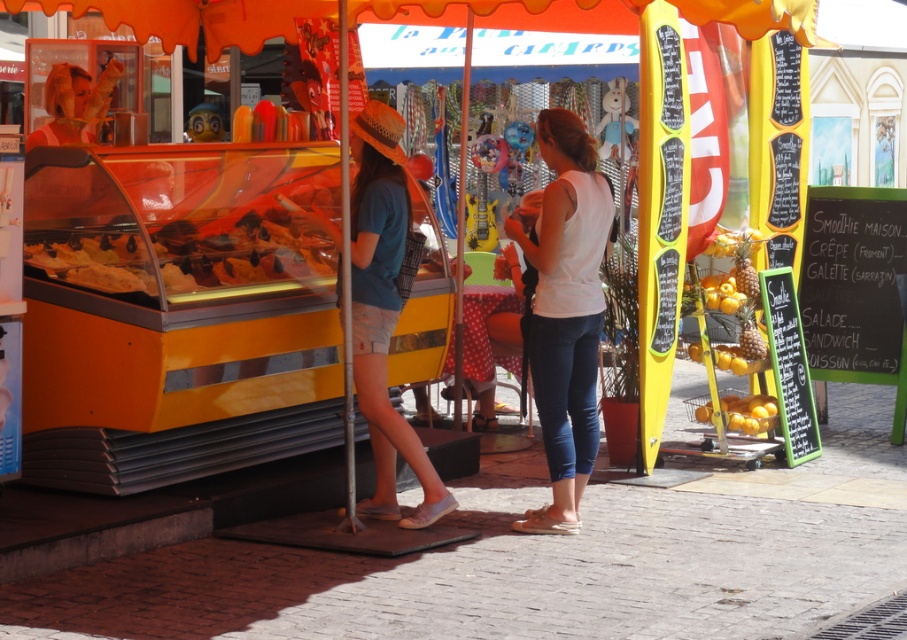
Can you confirm if denim shorts at center is positioned above yellow matte oranges at right?

Indeed, denim shorts at center is positioned over yellow matte oranges at right.

Does denim shorts at center have a lesser width compared to yellow matte oranges at right?

No, denim shorts at center is not thinner than yellow matte oranges at right.

Measure the distance between denim shorts at center and camera.

A distance of 7.93 meters exists between denim shorts at center and camera.

Locate an element on the screen. denim shorts at center is located at coordinates (383, 310).

Is white matte tank top at center shorter than denim shorts at center?

Indeed, white matte tank top at center has a lesser height compared to denim shorts at center.

Who is more forward, (583, 252) or (388, 156)?

Positioned in front is point (583, 252).

In order to click on white matte tank top at center in this screenshot , I will do `click(564, 310)`.

Is point (591, 225) less distant than point (709, 413)?

Yes, it is in front of point (709, 413).

Which is more to the right, white matte tank top at center or yellow matte oranges at right?

From the viewer's perspective, yellow matte oranges at right appears more on the right side.

Identify the location of white matte tank top at center. (564, 310).

At what (x,y) coordinates should I click in order to perform the action: click on white matte tank top at center. Please return your answer as a coordinate pair (x, y). Looking at the image, I should click on (564, 310).